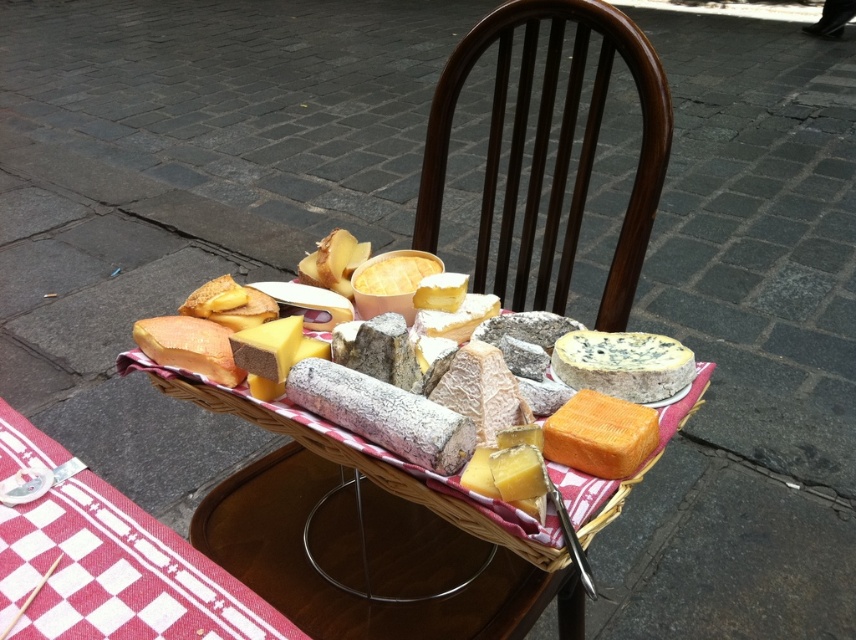
Does dark brown wood chair at center have a greater height compared to blue veined cheese at center?

Yes.

Who is lower down, dark brown wood chair at center or blue veined cheese at center?

blue veined cheese at center is lower down.

Is point (553, 22) less distant than point (675, 339)?

No, (553, 22) is further to viewer.

Where is `dark brown wood chair at center`? The height and width of the screenshot is (640, 856). dark brown wood chair at center is located at coordinates (545, 148).

Can you confirm if blue veined cheese at center is positioned below orange hard cheese at center?

Actually, blue veined cheese at center is above orange hard cheese at center.

Does point (649, 358) come farther from viewer compared to point (642, 436)?

Yes, point (649, 358) is farther from viewer.

Is point (670, 349) less distant than point (586, 394)?

No, (670, 349) is further to viewer.

I want to click on blue veined cheese at center, so click(x=623, y=364).

Can you confirm if red checkered fabric at lower left is shorter than orange hard cheese at center?

In fact, red checkered fabric at lower left may be taller than orange hard cheese at center.

Who is more distant from viewer, (194,572) or (568,401)?

The point (568,401) is behind.

Locate an element on the screen. The width and height of the screenshot is (856, 640). red checkered fabric at lower left is located at coordinates (117, 573).